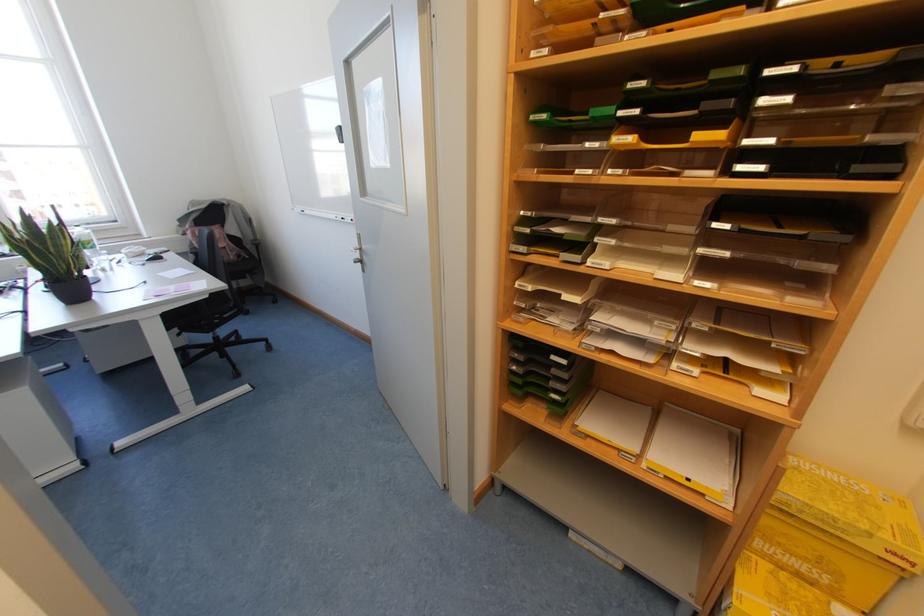
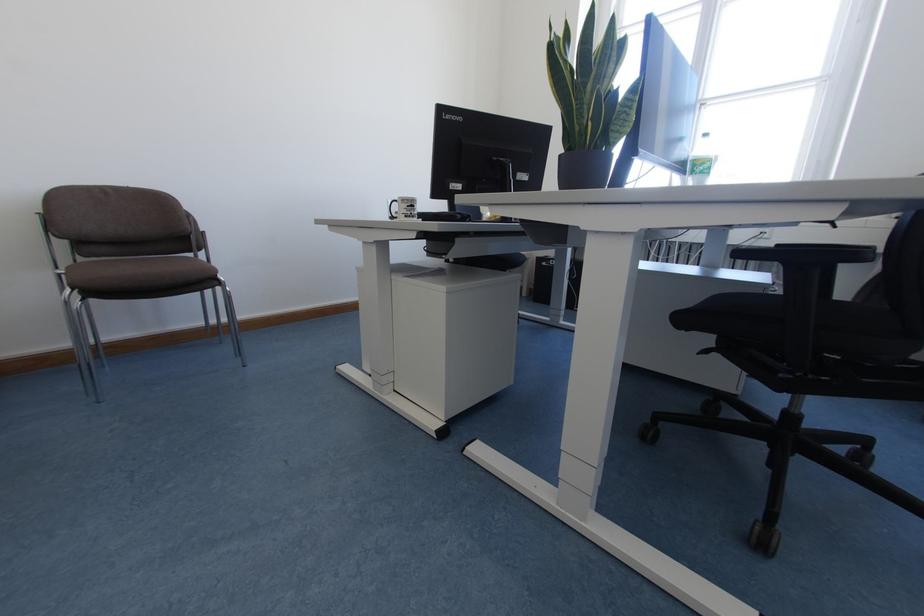
The point at (53, 245) is marked in the first image. Where is the corresponding point in the second image?

(593, 77)